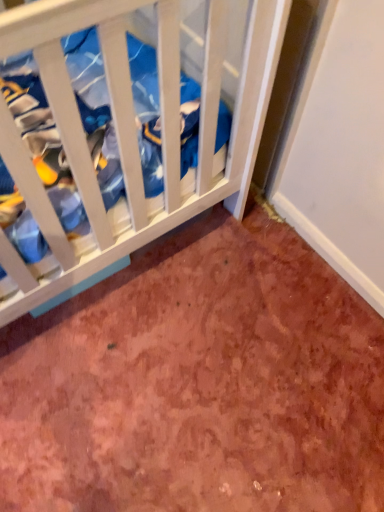
Question: From the image's perspective, is white wood crib at upper left under brown textured carpet at lower center?

Choices:
 (A) yes
 (B) no

Answer: (B)

Question: Is white wood crib at upper left turned away from brown textured carpet at lower center?

Choices:
 (A) yes
 (B) no

Answer: (B)

Question: Considering the relative sizes of white wood crib at upper left and brown textured carpet at lower center in the image provided, is white wood crib at upper left bigger than brown textured carpet at lower center?

Choices:
 (A) yes
 (B) no

Answer: (A)

Question: From a real-world perspective, is white wood crib at upper left over brown textured carpet at lower center?

Choices:
 (A) yes
 (B) no

Answer: (A)

Question: From the image's perspective, is white wood crib at upper left over brown textured carpet at lower center?

Choices:
 (A) yes
 (B) no

Answer: (A)

Question: Is white wood crib at upper left further to the viewer compared to brown textured carpet at lower center?

Choices:
 (A) no
 (B) yes

Answer: (A)

Question: Does brown textured carpet at lower center have a greater width compared to white wood crib at upper left?

Choices:
 (A) yes
 (B) no

Answer: (A)

Question: Is the depth of brown textured carpet at lower center less than that of white wood crib at upper left?

Choices:
 (A) no
 (B) yes

Answer: (A)

Question: From a real-world perspective, is brown textured carpet at lower center positioned under white wood crib at upper left based on gravity?

Choices:
 (A) no
 (B) yes

Answer: (B)

Question: Does brown textured carpet at lower center have a larger size compared to white wood crib at upper left?

Choices:
 (A) yes
 (B) no

Answer: (B)

Question: Can you confirm if brown textured carpet at lower center is positioned to the left of white wood crib at upper left?

Choices:
 (A) yes
 (B) no

Answer: (B)

Question: Considering the relative sizes of brown textured carpet at lower center and white wood crib at upper left in the image provided, is brown textured carpet at lower center shorter than white wood crib at upper left?

Choices:
 (A) no
 (B) yes

Answer: (B)

Question: Considering the positions of point (175, 287) and point (177, 144), is point (175, 287) closer or farther from the camera than point (177, 144)?

Choices:
 (A) farther
 (B) closer

Answer: (A)